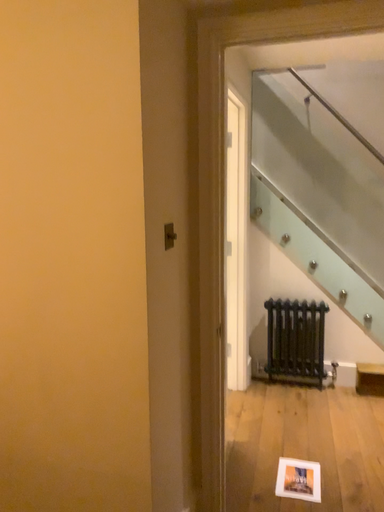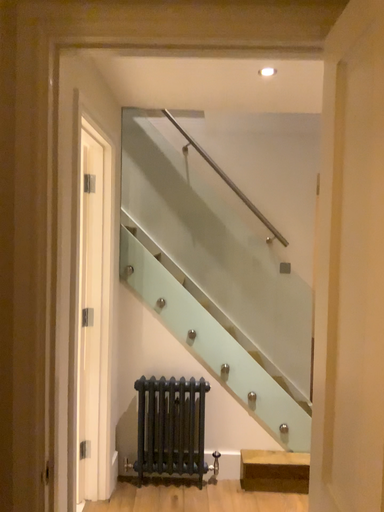
Question: How did the camera likely rotate when shooting the video?

Choices:
 (A) rotated left
 (B) rotated right

Answer: (B)